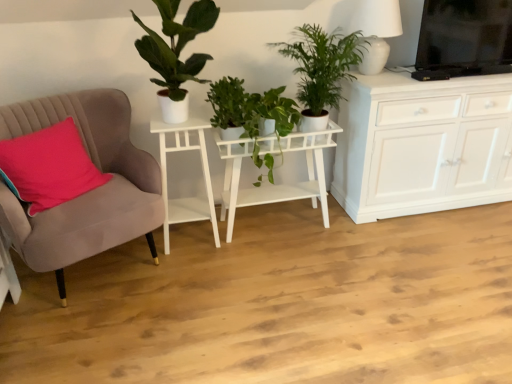
Locate an element on the screen. This screenshot has width=512, height=384. free point in front of white matte side table at left, which is counted as the 1th table, starting from the left is located at coordinates (x=186, y=268).